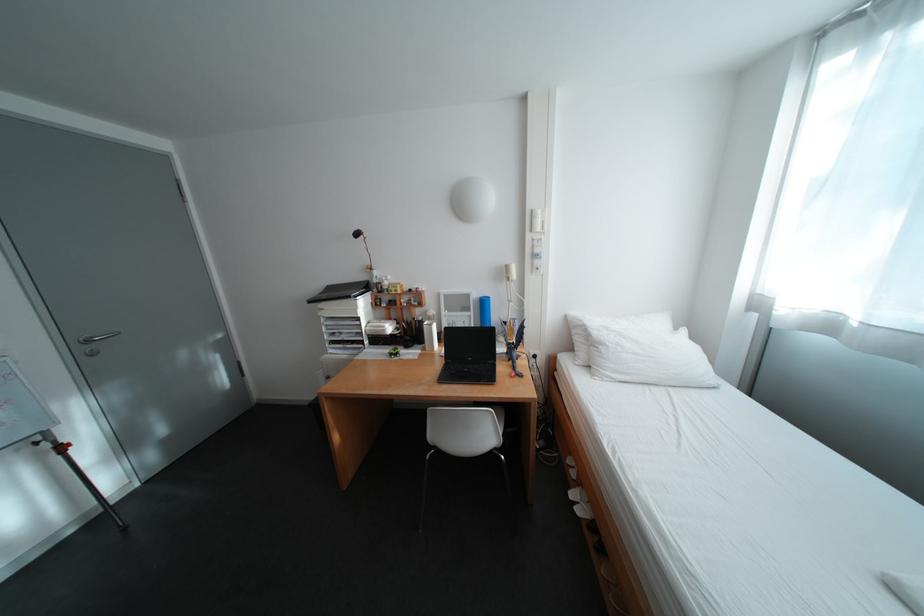
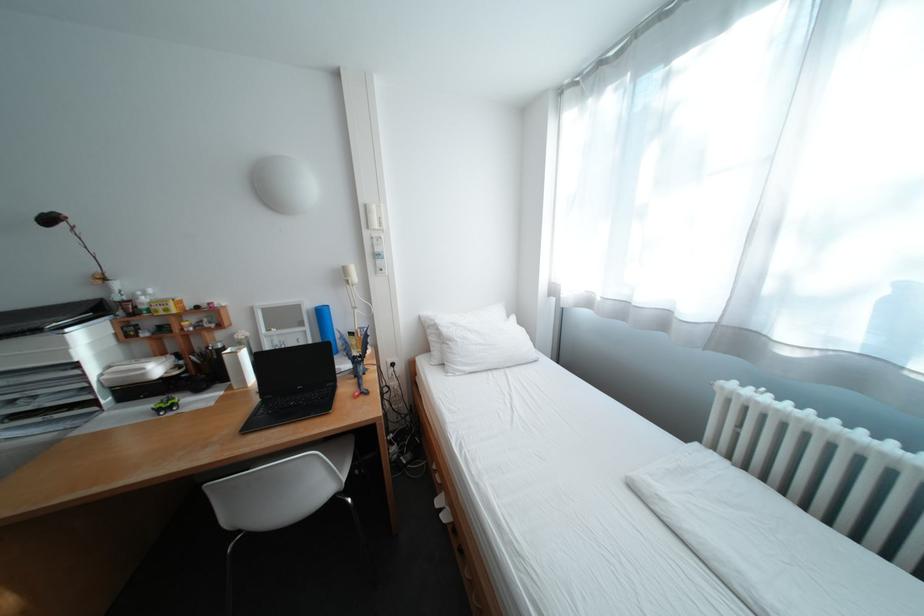
Question: The first image is from the beginning of the video and the second image is from the end. How did the camera likely rotate when shooting the video?

Choices:
 (A) Left
 (B) Right
 (C) Up
 (D) Down

Answer: (B)